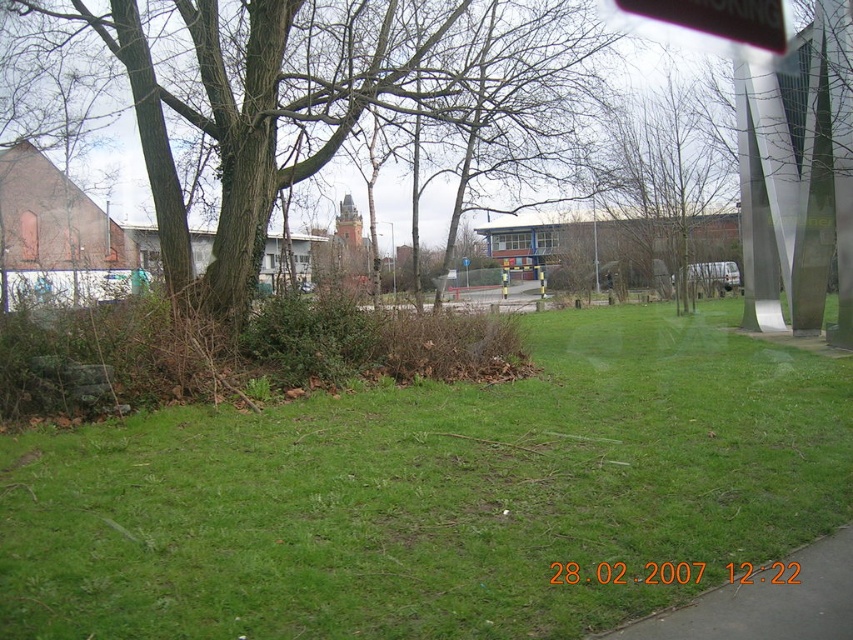
You are standing in the outdoor scene and want to walk from the brown rough bark tree at left to the green grass at center. Which direction should you move?

You should move to the right because the green grass at center is located to the right of the brown rough bark tree at left.

Consider the image. You are a hiker who wants to place a small marker between the brown rough bark tree at left and the black plastic sign at upper center. Which object should you place the marker closer to in order to ensure it is visible from the path below?

The marker should be placed closer to the brown rough bark tree at left because it is closer to the viewer, making it more visible from the path below.

You are standing in the outdoor scene and want to walk from the point at coordinates point (624,561) to the point at coordinates point (204,300). Which direction should you move to get closer to your destination?

To move from point (624,561) to point (204,300), you should move towards the lower left direction since point (624,561) is closer to the camera and your destination is further away in the lower left direction.